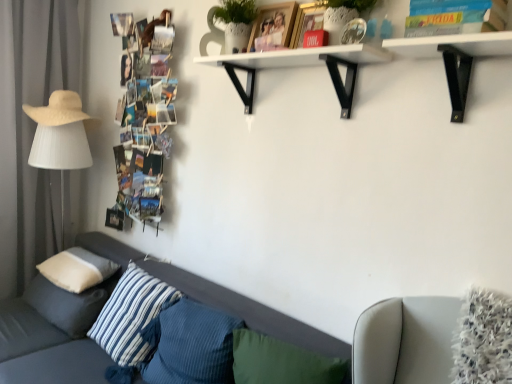
What is the approximate width of white soft cushion at lower left, the 1th pillow viewed from the left?

It is 16.21 inches.

The image size is (512, 384). What are the coordinates of `white matte pillow at left, which ranks as the third pillow in right-to-left order` in the screenshot? It's located at (77, 269).

Does strawmaterial/texturehat at left touch white soft cushion at lower left, the 1th pillow viewed from the left?

strawmaterial/texturehat at left is not next to white soft cushion at lower left, the 1th pillow viewed from the left, and they're not touching.

How distant is strawmaterial/texturehat at left from white soft cushion at lower left, the 1th pillow viewed from the left?

38.99 inches.

From the strawmaterial/texturehat at left, count 1st pillow to the right and point to it. Please provide its 2D coordinates.

[(68, 304)]

From a real-world perspective, which is physically below, strawmaterial/texturehat at left or white soft cushion at lower left, which is the 4th pillow in right-to-left order?

From a 3D spatial view, white soft cushion at lower left, which is the 4th pillow in right-to-left order, is below.

From a real-world perspective, is white matte table lamp at left on top of textured gray couch at lower left?

Correct, in the physical world, white matte table lamp at left is higher than textured gray couch at lower left.

Considering the sizes of objects white matte table lamp at left and textured gray couch at lower left in the image provided, who is smaller, white matte table lamp at left or textured gray couch at lower left?

Smaller between the two is white matte table lamp at left.

The width and height of the screenshot is (512, 384). Identify the location of studio couch in front of the white matte table lamp at left. (44, 349).

Based on their positions, is strawmaterial/texturehat at left located to the left or right of blue striped pillow at lower left, which is the 4th pillow from left to right?

From the image, it's evident that strawmaterial/texturehat at left is to the left of blue striped pillow at lower left, which is the 4th pillow from left to right.

From the image's perspective, would you say strawmaterial/texturehat at left is shown under blue striped pillow at lower left, which is the 4th pillow from left to right?

Actually, strawmaterial/texturehat at left appears above blue striped pillow at lower left, which is the 4th pillow from left to right, in the image.

In terms of height, does strawmaterial/texturehat at left look taller or shorter compared to blue striped pillow at lower left, placed as the first pillow when sorted from right to left?

Clearly, strawmaterial/texturehat at left is shorter compared to blue striped pillow at lower left, placed as the first pillow when sorted from right to left.

Is strawmaterial/texturehat at left far away from blue striped pillow at lower left, which is the 4th pillow from left to right?

Yes, strawmaterial/texturehat at left and blue striped pillow at lower left, which is the 4th pillow from left to right, are located far from each other.

Is point (127, 112) positioned behind point (84, 283)?

Yes, it is.

Based on their sizes in the image, would you say printed paper collage at left, which is the 1th book in back-to-front order, is bigger or smaller than white matte pillow at left, the 2th pillow positioned from the left?

printed paper collage at left, which is the 1th book in back-to-front order, is bigger than white matte pillow at left, the 2th pillow positioned from the left.

From the image's perspective, which is above, printed paper collage at left, placed as the 2th book when sorted from front to back, or white matte pillow at left, which ranks as the third pillow in right-to-left order?

printed paper collage at left, placed as the 2th book when sorted from front to back, is shown above in the image.

Between printed paper collage at left, the first book viewed from the left, and white matte pillow at left, the 2th pillow positioned from the left, which one has less height?

Standing shorter between the two is white matte pillow at left, the 2th pillow positioned from the left.

Considering the sizes of white matte shelf at upper center and printed paper collage at left, which is the 1th book in back-to-front order, in the image, is white matte shelf at upper center taller or shorter than printed paper collage at left, which is the 1th book in back-to-front order,?

In the image, white matte shelf at upper center appears to be shorter than printed paper collage at left, which is the 1th book in back-to-front order.

Can you confirm if white matte shelf at upper center is smaller than printed paper collage at left, the first book viewed from the left?

Yes.

Which object is further away from the camera taking this photo, white matte shelf at upper center or printed paper collage at left, which is counted as the 2th book, starting from the right?

printed paper collage at left, which is counted as the 2th book, starting from the right, is behind.

From a real-world perspective, who is located higher, white matte shelf at upper center or printed paper collage at left, which is the 1th book in back-to-front order?

In real-world perspective, white matte shelf at upper center is above.

What's the angular difference between blue striped pillow at lower left, which is the 4th pillow from left to right, and matte red book at upper center, positioned as the second book in back-to-front order,'s facing directions?

The facing directions of blue striped pillow at lower left, which is the 4th pillow from left to right, and matte red book at upper center, positioned as the second book in back-to-front order, are 2.31 degrees apart.

From the picture: Is blue striped pillow at lower left, placed as the first pillow when sorted from right to left, positioned with its back to matte red book at upper center, the first book viewed from the front?

No, blue striped pillow at lower left, placed as the first pillow when sorted from right to left,'s orientation is not away from matte red book at upper center, the first book viewed from the front.

The height and width of the screenshot is (384, 512). Identify the location of book in front of the blue striped pillow at lower left, which is the 4th pillow from left to right. pyautogui.click(x=307, y=21).

Would you say blue striped pillow at lower left, which is the 4th pillow from left to right, is to the left or to the right of matte red book at upper center, arranged as the first book when viewed from the right, in the picture?

In the image, blue striped pillow at lower left, which is the 4th pillow from left to right, appears on the left side of matte red book at upper center, arranged as the first book when viewed from the right.

Which object is wider, blue striped pillow at lower left, placed as the first pillow when sorted from right to left, or gray fabric curtain at left?

blue striped pillow at lower left, placed as the first pillow when sorted from right to left.

From the picture: From the image's perspective, is blue striped pillow at lower left, placed as the first pillow when sorted from right to left, on top of gray fabric curtain at left?

No, from the image's perspective, blue striped pillow at lower left, placed as the first pillow when sorted from right to left, is not on top of gray fabric curtain at left.

Does blue striped pillow at lower left, placed as the first pillow when sorted from right to left, appear on the right side of gray fabric curtain at left?

Yes, blue striped pillow at lower left, placed as the first pillow when sorted from right to left, is to the right of gray fabric curtain at left.

This screenshot has width=512, height=384. Find the location of `the 2nd pillow in front of the strawmaterial/texturehat at left`. the 2nd pillow in front of the strawmaterial/texturehat at left is located at coordinates (68, 304).

Where is `table lamp above the textured gray couch at lower left (from the image's perspective)`? table lamp above the textured gray couch at lower left (from the image's perspective) is located at coordinates (61, 152).

From the picture: From the image, which object appears to be nearer to blue striped pillow at lower left, placed as the first pillow when sorted from right to left, gray fabric curtain at left or textured gray couch at lower left?

Based on the image, textured gray couch at lower left appears to be nearer to blue striped pillow at lower left, placed as the first pillow when sorted from right to left.

Looking at the image, which one is located further to white matte table lamp at left, blue striped pillow at lower left, which is the 4th pillow from left to right, or printed paper collage at left, the first book viewed from the left?

blue striped pillow at lower left, which is the 4th pillow from left to right, lies further to white matte table lamp at left than the other object.

Looking at the image, which one is located further to blue striped pillow at lower left, placed as the first pillow when sorted from right to left, white matte pillow at left, the 2th pillow positioned from the left, or white matte shelf at upper center?

white matte shelf at upper center is further to blue striped pillow at lower left, placed as the first pillow when sorted from right to left.

Based on the photo, based on their spatial positions, is white matte table lamp at left or white matte pillow at left, which ranks as the third pillow in right-to-left order, closer to printed paper collage at left, placed as the 2th book when sorted from front to back?

Among the two, white matte table lamp at left is located nearer to printed paper collage at left, placed as the 2th book when sorted from front to back.

Considering their positions, is white soft cushion at lower left, which is the 4th pillow in right-to-left order, positioned further to strawmaterial/texturehat at left than blue striped pillow at lower left, which is counted as the 3th pillow, starting from the left?

blue striped pillow at lower left, which is counted as the 3th pillow, starting from the left.

From the image, which object appears to be nearer to strawmaterial/texturehat at left, matte red book at upper center, arranged as the first book when viewed from the right, or white matte shelf at upper center?

white matte shelf at upper center lies closer to strawmaterial/texturehat at left than the other object.

Looking at the image, which one is located closer to strawmaterial/texturehat at left, white matte pillow at left, the 2th pillow positioned from the left, or white soft cushion at lower left, which is the 4th pillow in right-to-left order?

white matte pillow at left, the 2th pillow positioned from the left.

Based on their spatial positions, is white matte table lamp at left or gray fabric curtain at left closer to blue striped pillow at lower left, which is the 4th pillow from left to right?

white matte table lamp at left is positioned closer to the anchor blue striped pillow at lower left, which is the 4th pillow from left to right.

Find the location of a particular element. shelf between strawmaterial/texturehat at left and matte red book at upper center, positioned as the second book in back-to-front order, from left to right is located at coordinates [301, 66].

Where is `studio couch situated between gray fabric curtain at left and matte red book at upper center, arranged as the first book when viewed from the right, from left to right`? studio couch situated between gray fabric curtain at left and matte red book at upper center, arranged as the first book when viewed from the right, from left to right is located at coordinates (44, 349).

You are a GUI agent. You are given a task and a screenshot of the screen. Output one action in this format:
    pyautogui.click(x=<x>, y=<y>)
    Task: Click on the straw hat between matte red book at upper center, the first book viewed from the front, and blue striped pillow at lower left, which is the 4th pillow from left to right, vertically
    
    Given the screenshot: What is the action you would take?
    pyautogui.click(x=60, y=110)

Locate an element on the screen. This screenshot has width=512, height=384. table lamp between strawmaterial/texturehat at left and blue striped pillow at lower left, which is the 4th pillow from left to right, in the vertical direction is located at coordinates (61, 152).